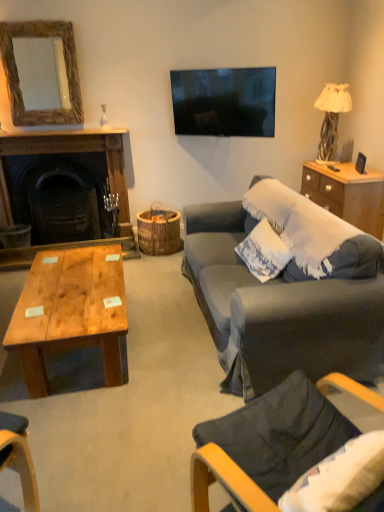
Question: From a real-world perspective, is wooden frame mirror at upper left over dark gray fabric chair at lower right?

Choices:
 (A) yes
 (B) no

Answer: (A)

Question: Is dark gray fabric chair at lower right inside wooden frame mirror at upper left?

Choices:
 (A) yes
 (B) no

Answer: (B)

Question: Is wooden frame mirror at upper left shorter than dark gray fabric chair at lower right?

Choices:
 (A) no
 (B) yes

Answer: (A)

Question: Is the depth of wooden frame mirror at upper left less than that of dark gray fabric chair at lower right?

Choices:
 (A) yes
 (B) no

Answer: (B)

Question: From the image's perspective, would you say wooden frame mirror at upper left is shown under dark gray fabric chair at lower right?

Choices:
 (A) yes
 (B) no

Answer: (B)

Question: Considering the relative sizes of wooden frame mirror at upper left and dark gray fabric chair at lower right in the image provided, is wooden frame mirror at upper left thinner than dark gray fabric chair at lower right?

Choices:
 (A) no
 (B) yes

Answer: (B)

Question: Is dark wood fireplace at left surrounded by white textured pillow at right?

Choices:
 (A) yes
 (B) no

Answer: (B)

Question: Is white textured pillow at right wider than dark wood fireplace at left?

Choices:
 (A) yes
 (B) no

Answer: (B)

Question: Can you confirm if white textured pillow at right is thinner than dark wood fireplace at left?

Choices:
 (A) no
 (B) yes

Answer: (B)

Question: Considering the relative sizes of white textured pillow at right and dark wood fireplace at left in the image provided, is white textured pillow at right taller than dark wood fireplace at left?

Choices:
 (A) no
 (B) yes

Answer: (A)

Question: Considering the relative sizes of white textured pillow at right and dark wood fireplace at left in the image provided, is white textured pillow at right bigger than dark wood fireplace at left?

Choices:
 (A) yes
 (B) no

Answer: (B)

Question: Is white textured pillow at right not inside dark wood fireplace at left?

Choices:
 (A) yes
 (B) no

Answer: (A)

Question: From the image's perspective, is wooden coffee table at center located above white textured pillow at right?

Choices:
 (A) yes
 (B) no

Answer: (B)